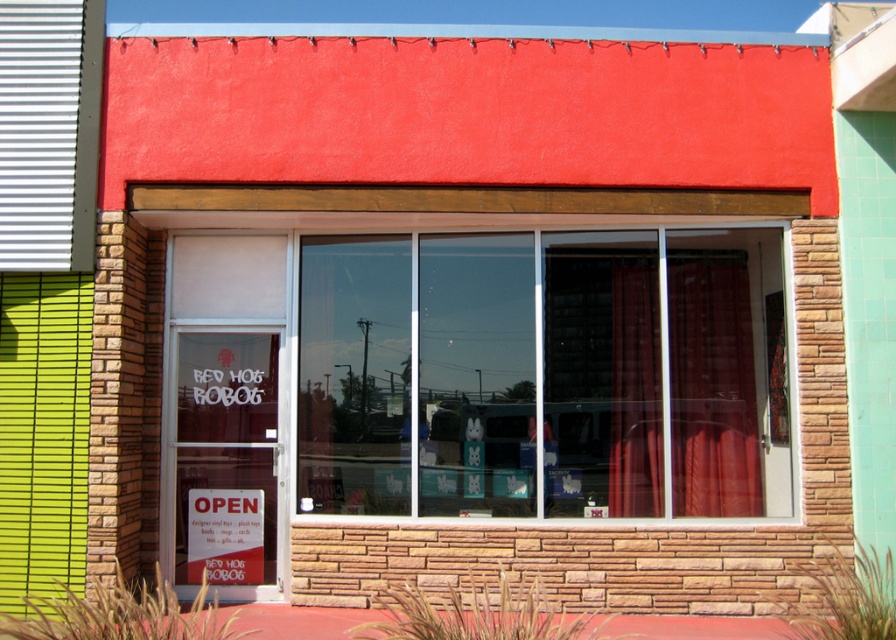
Question: Can you confirm if transparent glass window at center is positioned to the right of red plastic sign at center?

Choices:
 (A) yes
 (B) no

Answer: (A)

Question: Considering the real-world distances, which object is closest to the transparent glass window at center?

Choices:
 (A) red plastic sign at center
 (B) red velvet curtain at center

Answer: (B)

Question: Which object appears farthest from the camera in this image?

Choices:
 (A) red velvet curtain at center
 (B) transparent glass window at center

Answer: (A)

Question: Which object is farther from the camera taking this photo?

Choices:
 (A) transparent glass window at center
 (B) red plastic sign at center
 (C) red velvet curtain at center

Answer: (B)

Question: Does transparent glass window at center have a larger size compared to red velvet curtain at center?

Choices:
 (A) yes
 (B) no

Answer: (A)

Question: Is the position of transparent glass window at center more distant than that of red plastic sign at center?

Choices:
 (A) yes
 (B) no

Answer: (B)